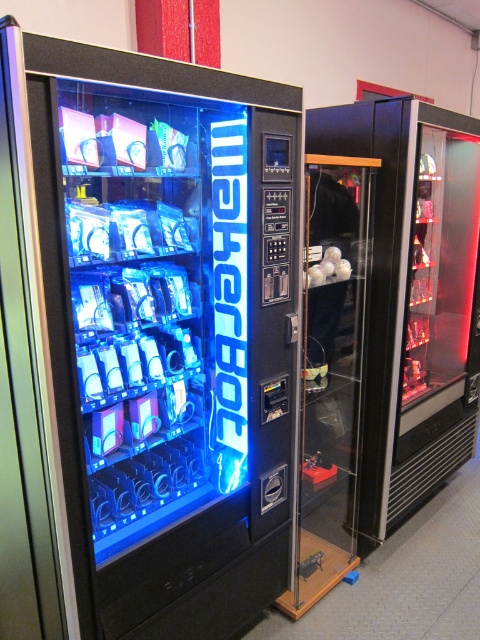
You are standing in front of the vending machines and want to take a photo of the matte black vending machine at left with your smartphone camera. Can you do this without moving closer or farther away from your current position?

The matte black vending machine at left and camera are 3.64 feet apart from each other. Since the typical focusing range for smartphones starts at about 8 inches and extends to infinity, you can take the photo without moving closer or farther away from your current position.

You are trying to determine which vending machine is narrower between the matte black vending machine at left and the transparent glass beverage dispenser at right. Based on the scene, which one is thinner?

The matte black vending machine at left is thinner than the transparent glass beverage dispenser at right according to the description.